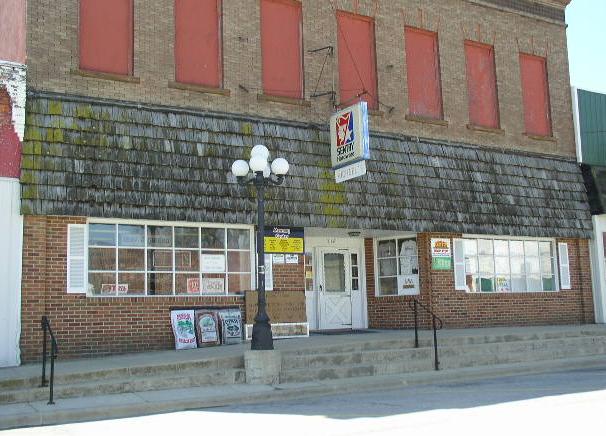
Locate an element on the screen. This screenshot has width=606, height=436. window shutters is located at coordinates (71, 255), (268, 264), (456, 259), (562, 265).